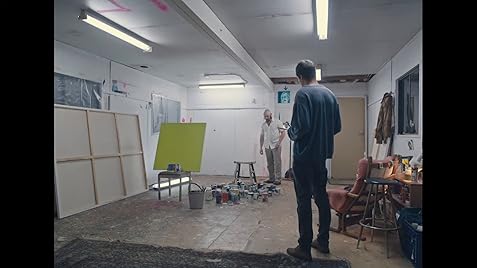
Image resolution: width=477 pixels, height=268 pixels. What are the coordinates of `fluorescent bulb` in the screenshot? It's located at (105, 31), (235, 86), (323, 23), (321, 72).